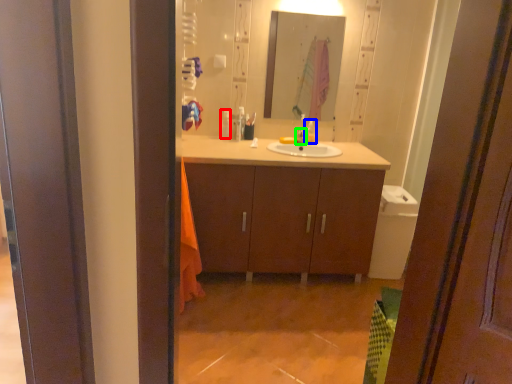
Question: Which object is the farthest from toiletry (highlighted by a red box)? Choose among these: toiletry (highlighted by a blue box) or tap (highlighted by a green box).

Choices:
 (A) toiletry
 (B) tap

Answer: (A)